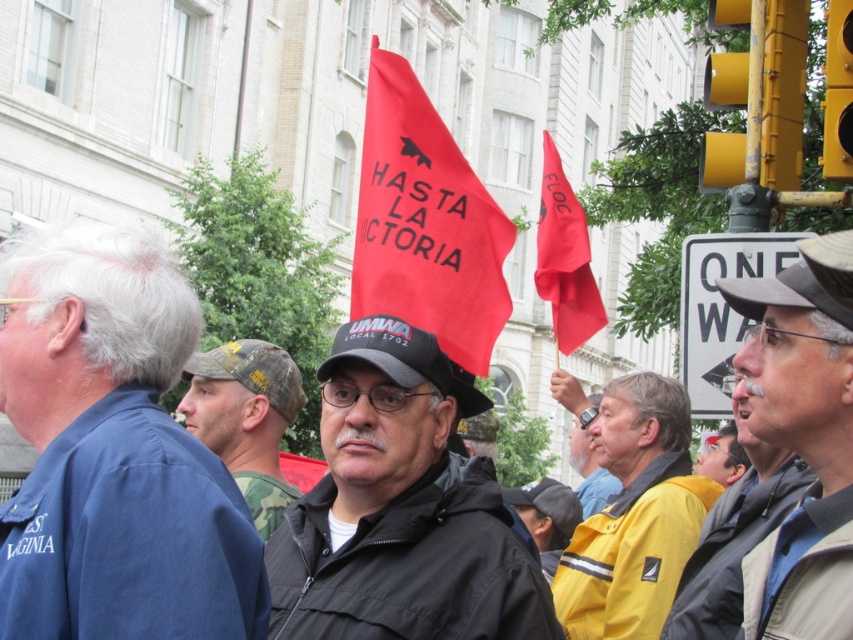
You are a photographer at the protest. You need to capture a photo that includes both the gray fabric jacket at center and the yellow jacket at center. Based on their positions, which jacket should be placed on the left side of the photo to ensure both are visible?

The yellow jacket at center should be placed on the left side of the photo because the gray fabric jacket at center is to the right of it, so positioning the yellow jacket on the left will keep them in their correct spatial relationship and ensure both are visible.

You are a photographer standing at the center of the protest scene. You want to take a photo that includes both the point at coordinates point(x=109, y=397) and the point at coordinates point(x=741, y=508). Which point should you position closer to the camera to ensure both are in focus?

Since point(x=109, y=397) is closer to the viewer than point(x=741, y=508), you should position the camera closer to point(x=109, y=397) to ensure both are in focus.